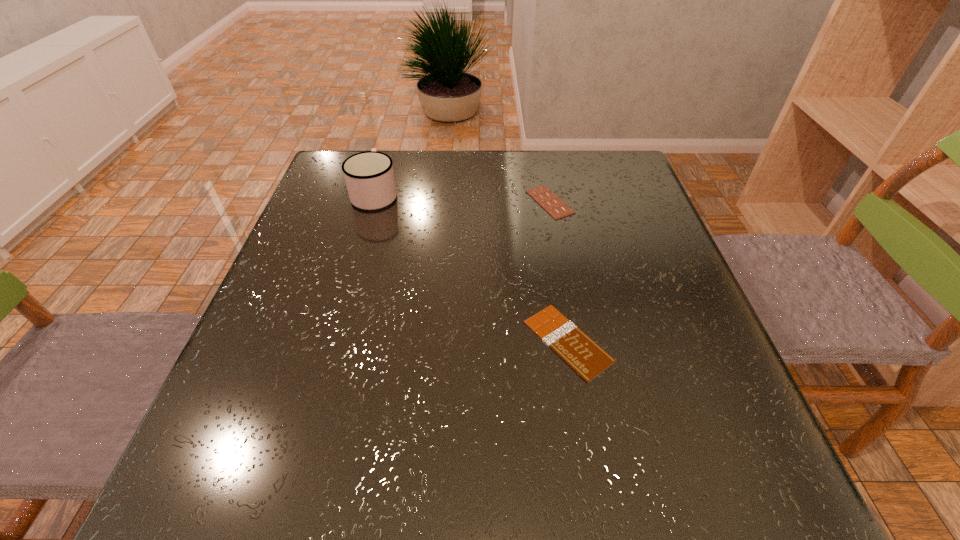
I want to click on the leftmost object, so click(369, 176).

Locate an element on the screen. The height and width of the screenshot is (540, 960). the tallest object is located at coordinates (369, 176).

Image resolution: width=960 pixels, height=540 pixels. What are the coordinates of `the farther chocolate bar` in the screenshot? It's located at (542, 195).

Find the location of `the taller chocolate bar`. the taller chocolate bar is located at coordinates (542, 195).

This screenshot has height=540, width=960. What are the coordinates of `the shortest object` in the screenshot? It's located at (568, 341).

This screenshot has height=540, width=960. I want to click on the nearest object, so click(568, 341).

Locate an element on the screen. The height and width of the screenshot is (540, 960). free point located on the right of the taller chocolate bar is located at coordinates (647, 202).

The width and height of the screenshot is (960, 540). I want to click on free space located 0.270m on the left of the shorter chocolate bar, so click(x=379, y=341).

The image size is (960, 540). What are the coordinates of `mug at the far edge` in the screenshot? It's located at (369, 176).

The image size is (960, 540). I want to click on chocolate bar positioned at the far edge, so click(542, 195).